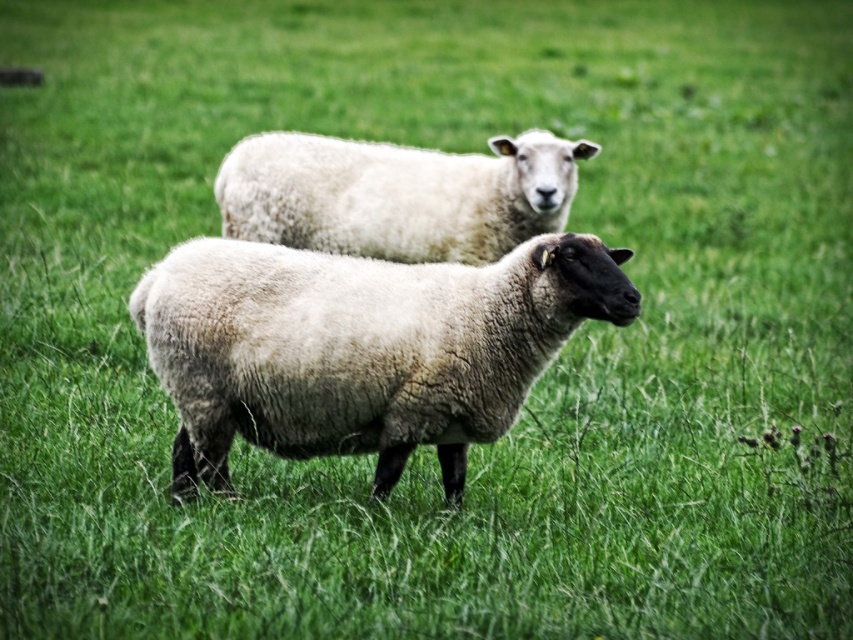
Who is positioned more to the left, white woolen sheep at center or white woolly sheep at upper center?

Positioned to the left is white woolly sheep at upper center.

At what (x,y) coordinates should I click in order to perform the action: click on white woolen sheep at center. Please return your answer as a coordinate pair (x, y). Looking at the image, I should click on [x=360, y=348].

Locate an element on the screen. Image resolution: width=853 pixels, height=640 pixels. white woolen sheep at center is located at coordinates (360, 348).